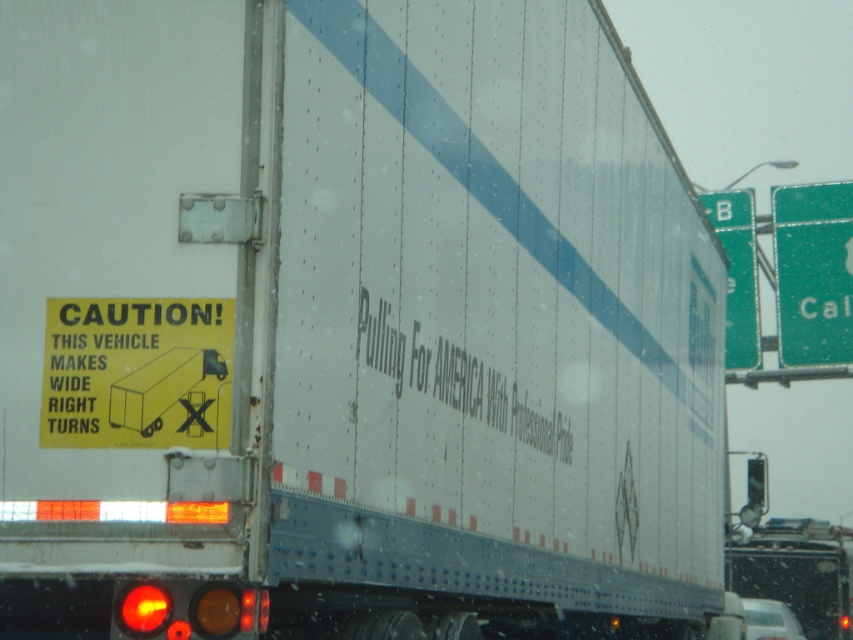
Question: Can you confirm if green metallic sign at upper right is smaller than green glossy sign at upper right?

Choices:
 (A) yes
 (B) no

Answer: (A)

Question: Which object is closer to the camera taking this photo?

Choices:
 (A) green metallic sign at upper right
 (B) green glossy sign at upper right

Answer: (B)

Question: Observing the image, what is the correct spatial positioning of green metallic sign at upper right in reference to green glossy sign at upper right?

Choices:
 (A) left
 (B) right

Answer: (B)

Question: Can you confirm if green metallic sign at upper right is positioned to the right of green glossy sign at upper right?

Choices:
 (A) yes
 (B) no

Answer: (A)

Question: Which of the following is the closest to the observer?

Choices:
 (A) (735, 204)
 (B) (799, 356)

Answer: (B)